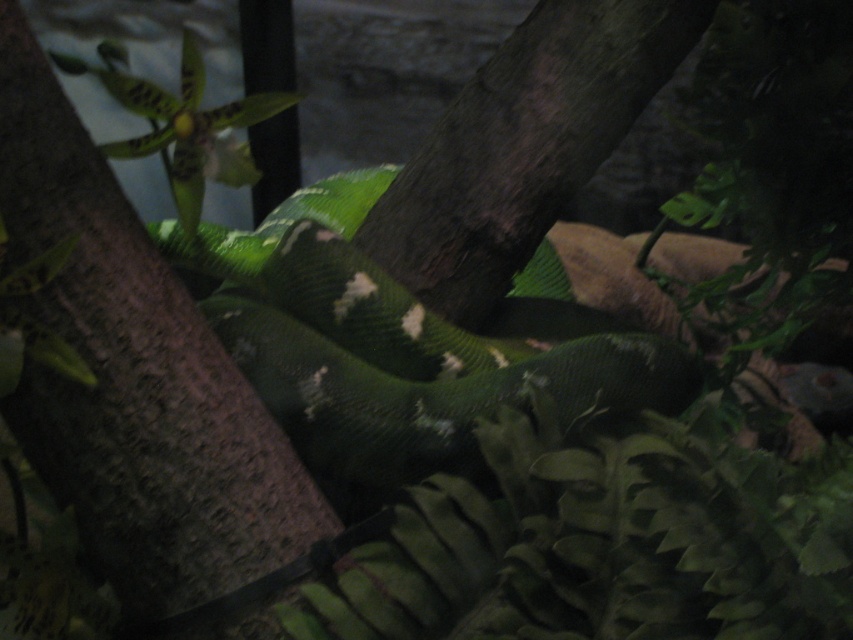
Who is shorter, smooth brown tree trunk at center or green matte snake at center?

green matte snake at center is shorter.

Which of these two, smooth brown tree trunk at center or green matte snake at center, stands taller?

smooth brown tree trunk at center is taller.

The width and height of the screenshot is (853, 640). I want to click on smooth brown tree trunk at center, so click(x=135, y=376).